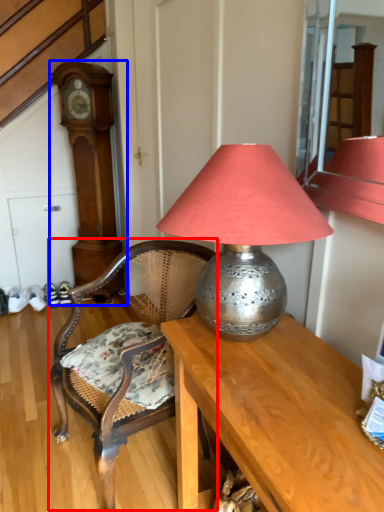
Question: Which of the following is the farthest to the observer, chair (highlighted by a red box) or clock (highlighted by a blue box)?

Choices:
 (A) chair
 (B) clock

Answer: (B)